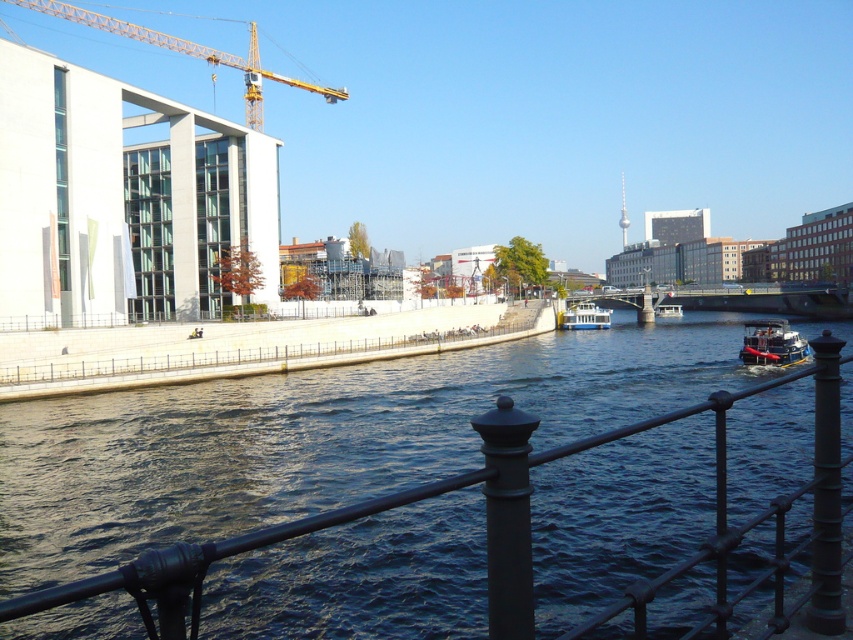
Which is in front, point (132, 33) or point (583, 310)?

Point (132, 33)

The width and height of the screenshot is (853, 640). Find the location of `yellow metallic crane at upper left`. yellow metallic crane at upper left is located at coordinates (190, 52).

In order to click on yellow metallic crane at upper left in this screenshot , I will do `click(190, 52)`.

Where is `yellow metallic crane at upper left`? yellow metallic crane at upper left is located at coordinates (190, 52).

Is metallic red boat at right to the right of white glossy boat at center from the viewer's perspective?

No, metallic red boat at right is not to the right of white glossy boat at center.

Which is in front, point (761, 346) or point (595, 324)?

Point (761, 346)

Measure the distance between point (x=798, y=344) and camera.

44.91 meters

Locate an element on the screen. The height and width of the screenshot is (640, 853). metallic red boat at right is located at coordinates (770, 342).

Based on the photo, is dark blue water at center bigger than yellow metallic crane at upper left?

No, dark blue water at center is not bigger than yellow metallic crane at upper left.

Does dark blue water at center have a lesser height compared to yellow metallic crane at upper left?

Correct, dark blue water at center is not as tall as yellow metallic crane at upper left.

Which is in front, point (369, 456) or point (76, 8)?

Point (369, 456) is more forward.

Find the location of `dark blue water at center`. dark blue water at center is located at coordinates (316, 436).